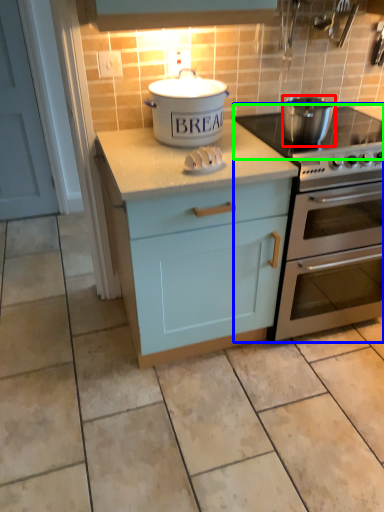
Question: Which object is the farthest from kitchen appliance (highlighted by a red box)? Choose among these: oven (highlighted by a blue box) or gas stove (highlighted by a green box).

Choices:
 (A) oven
 (B) gas stove

Answer: (A)